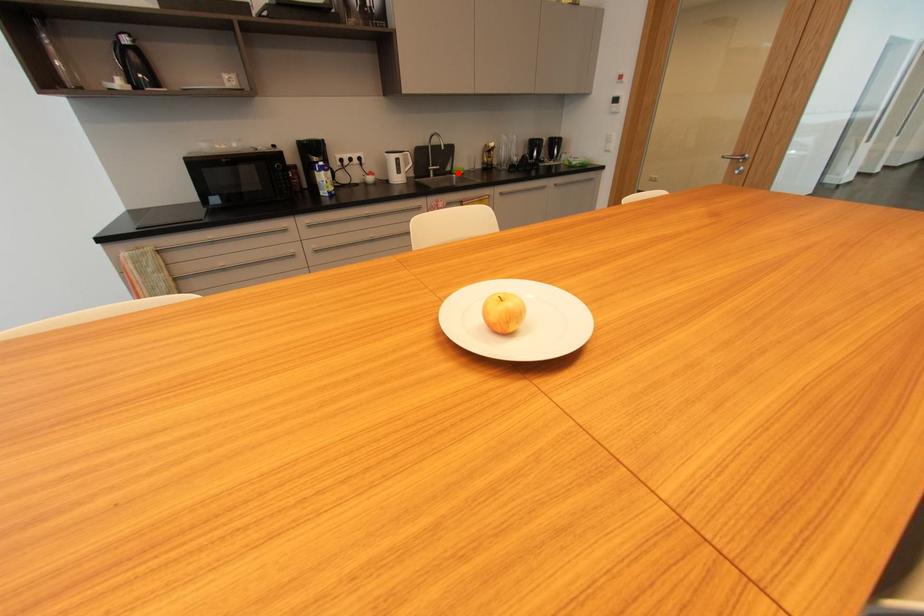
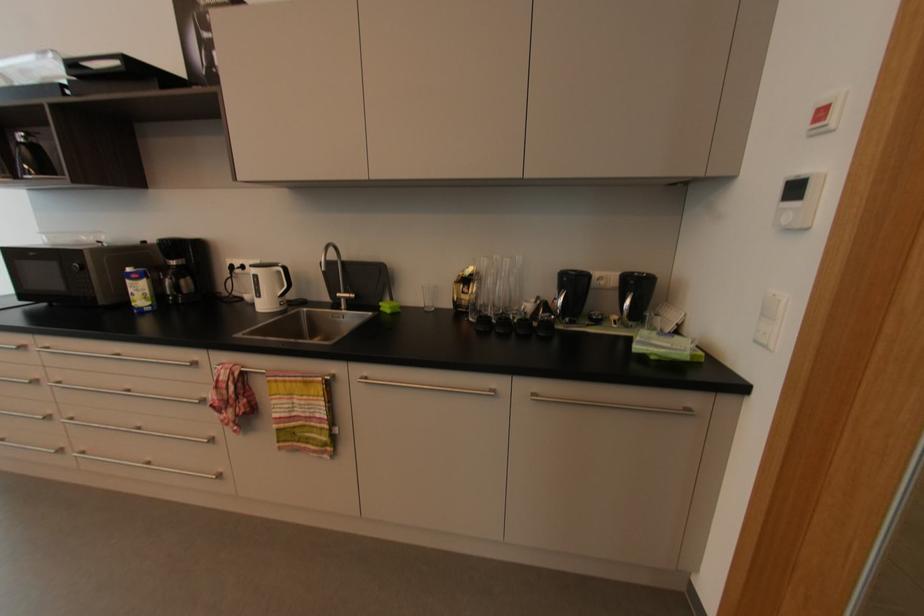
Question: I am providing you with two images of the same scene from different viewpoints. Given a red point in image1, look at the same physical point in image2. Is it:

Choices:
 (A) Closer to the viewpoint
 (B) Farther from the viewpoint

Answer: (B)